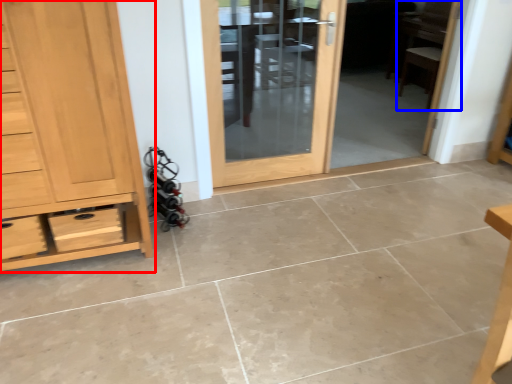
Question: Which of the following is the closest to the observer, chest of drawers (highlighted by a red box) or chair (highlighted by a blue box)?

Choices:
 (A) chest of drawers
 (B) chair

Answer: (A)